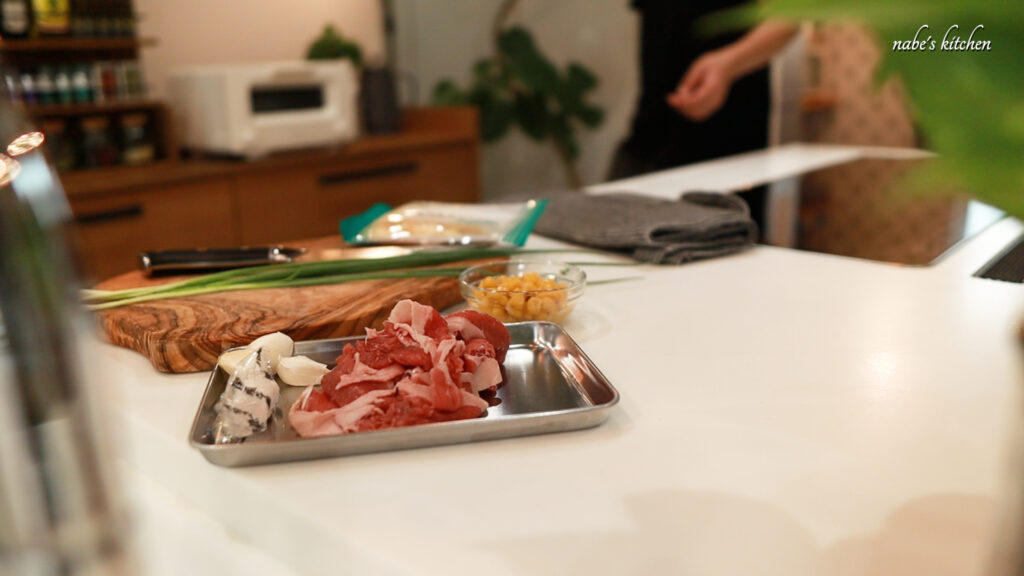
Find the location of a particular element. green plant is located at coordinates (514, 81).